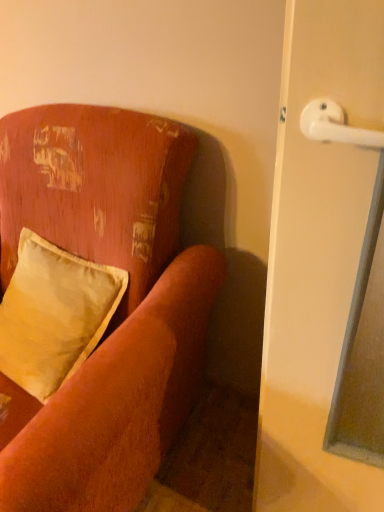
Question: From the image's perspective, is satin yellow pillow at left positioned above or below velvet-like orange couch at upper left?

Choices:
 (A) below
 (B) above

Answer: (B)

Question: Considering the positions of satin yellow pillow at left and velvet-like orange couch at upper left in the image, is satin yellow pillow at left wider or thinner than velvet-like orange couch at upper left?

Choices:
 (A) wide
 (B) thin

Answer: (B)

Question: In the image, is satin yellow pillow at left positioned in front of or behind velvet-like orange couch at upper left?

Choices:
 (A) behind
 (B) front

Answer: (A)

Question: Is velvet-like orange couch at upper left taller or shorter than satin yellow pillow at left?

Choices:
 (A) short
 (B) tall

Answer: (B)

Question: From the image's perspective, is velvet-like orange couch at upper left located above or below satin yellow pillow at left?

Choices:
 (A) below
 (B) above

Answer: (A)

Question: Would you say velvet-like orange couch at upper left is to the left or to the right of satin yellow pillow at left in the picture?

Choices:
 (A) right
 (B) left

Answer: (B)

Question: Would you say velvet-like orange couch at upper left is inside or outside satin yellow pillow at left?

Choices:
 (A) inside
 (B) outside

Answer: (B)